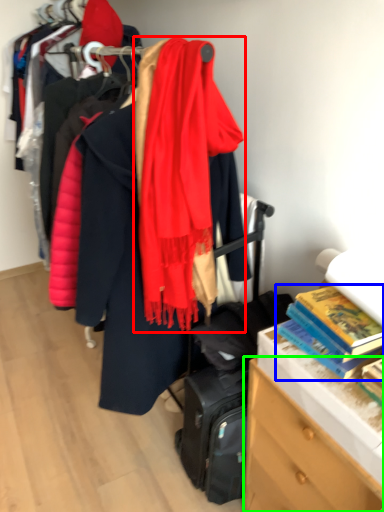
Question: Which object is the closest to the scarf (highlighted by a red box)? Choose among these: book (highlighted by a blue box) or chest of drawers (highlighted by a green box).

Choices:
 (A) book
 (B) chest of drawers

Answer: (A)